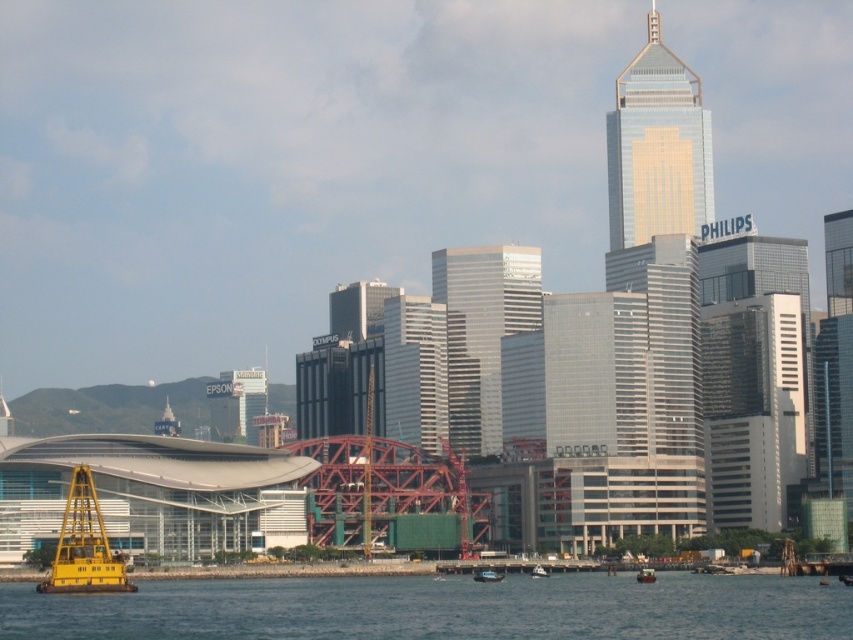
Question: Which object is the farthest from the glassy silver skyscraper at center?

Choices:
 (A) glossy glass skyscraper at center
 (B) white plastic boat at center
 (C) metallic yellow boat at lower center
 (D) blue water at lower center

Answer: (D)

Question: Which point is closer to the camera taking this photo?

Choices:
 (A) (704, 160)
 (B) (492, 294)

Answer: (A)

Question: Is glossy glass skyscraper at center thinner than yellow metallic barge at lower left?

Choices:
 (A) no
 (B) yes

Answer: (B)

Question: Which is farther from the blue water at lower center?

Choices:
 (A) yellow metallic barge at lower left
 (B) gold glass skyscraper at upper right
 (C) white plastic boat at center
 (D) metallic blue boat at center

Answer: (B)

Question: Can you confirm if yellow metallic barge at lower left is positioned to the right of metallic blue boat at center?

Choices:
 (A) yes
 (B) no

Answer: (B)

Question: Can you confirm if glassy silver skyscraper at center is bigger than metallic yellow boat at lower center?

Choices:
 (A) yes
 (B) no

Answer: (A)